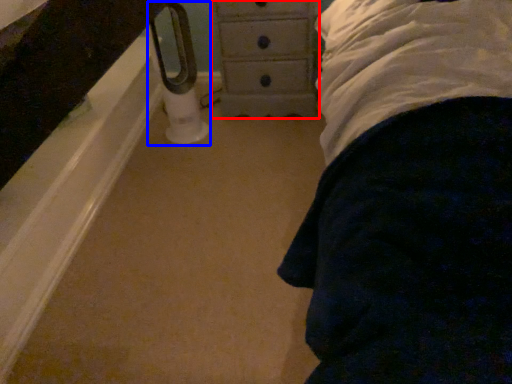
Question: Which of the following is the closest to the observer, chest of drawers (highlighted by a red box) or towel bar (highlighted by a blue box)?

Choices:
 (A) chest of drawers
 (B) towel bar

Answer: (B)